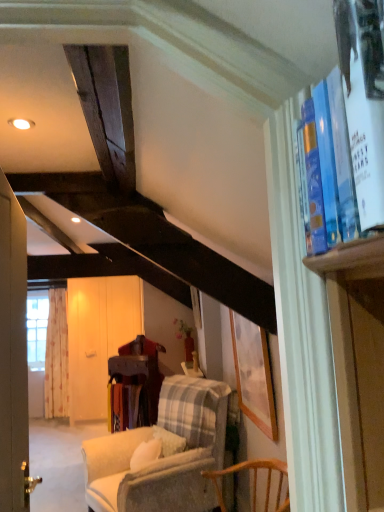
Question: From the image's perspective, is light beige fabric curtain at left below plaid fabric chair at center?

Choices:
 (A) yes
 (B) no

Answer: (B)

Question: Is light beige fabric curtain at left not close to plaid fabric chair at center?

Choices:
 (A) yes
 (B) no

Answer: (A)

Question: Is light beige fabric curtain at left to the left of plaid fabric chair at center from the viewer's perspective?

Choices:
 (A) no
 (B) yes

Answer: (B)

Question: From the image's perspective, is light beige fabric curtain at left above plaid fabric chair at center?

Choices:
 (A) no
 (B) yes

Answer: (B)

Question: Can you confirm if light beige fabric curtain at left is shorter than plaid fabric chair at center?

Choices:
 (A) no
 (B) yes

Answer: (A)

Question: Is light beige fabric curtain at left smaller than plaid fabric chair at center?

Choices:
 (A) no
 (B) yes

Answer: (B)

Question: Is white wood screen door at center positioned behind blue hardcover book at upper right?

Choices:
 (A) no
 (B) yes

Answer: (B)

Question: Is white wood screen door at center next to blue hardcover book at upper right?

Choices:
 (A) no
 (B) yes

Answer: (A)

Question: Would you say white wood screen door at center is outside blue hardcover book at upper right?

Choices:
 (A) no
 (B) yes

Answer: (B)

Question: Considering the relative sizes of white wood screen door at center and blue hardcover book at upper right in the image provided, is white wood screen door at center bigger than blue hardcover book at upper right?

Choices:
 (A) no
 (B) yes

Answer: (B)

Question: From the image's perspective, is white wood screen door at center on top of blue hardcover book at upper right?

Choices:
 (A) no
 (B) yes

Answer: (A)

Question: Considering the relative sizes of white wood screen door at center and blue hardcover book at upper right in the image provided, is white wood screen door at center wider than blue hardcover book at upper right?

Choices:
 (A) no
 (B) yes

Answer: (B)

Question: Does plaid fabric chair at center turn towards light beige fabric curtain at left?

Choices:
 (A) no
 (B) yes

Answer: (A)